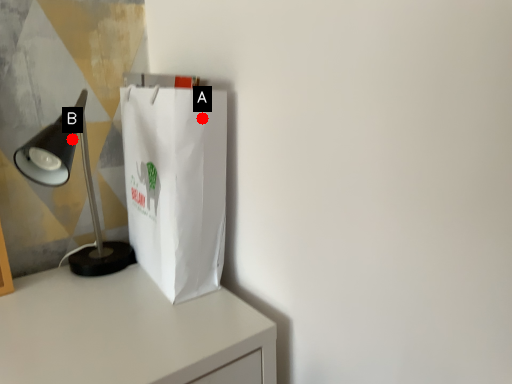
Question: Two points are circled on the image, labeled by A and B beside each circle. Which point is closer to the camera?

Choices:
 (A) A is closer
 (B) B is closer

Answer: (B)